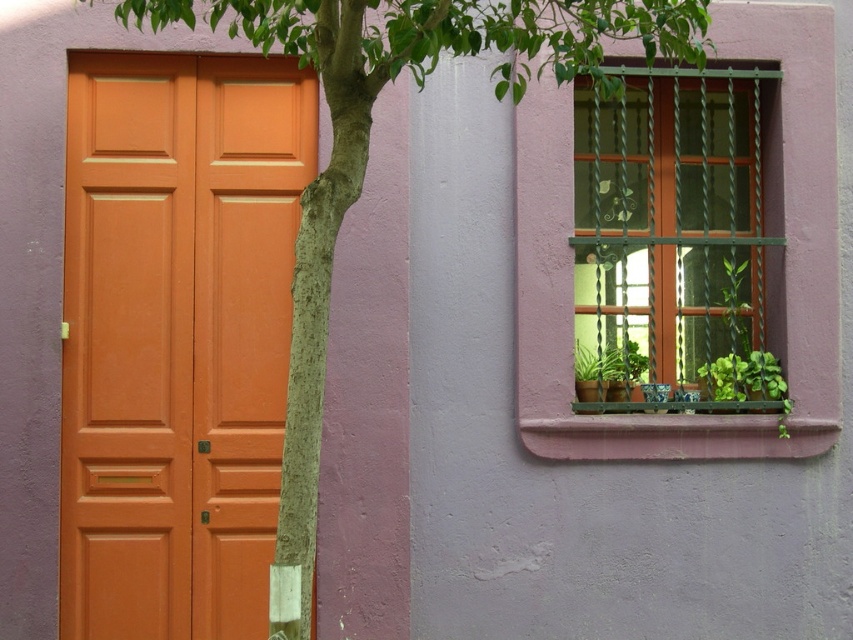
Is matte orange door at left thinner than green metal bars at upper right?

No, matte orange door at left is not thinner than green metal bars at upper right.

Does point (67, 400) lie in front of point (647, 371)?

Yes, point (67, 400) is closer to viewer.

Who is more distant from viewer, (212, 566) or (700, 355)?

The point (700, 355) is behind.

Find the location of a particular element. The width and height of the screenshot is (853, 640). matte orange door at left is located at coordinates (177, 337).